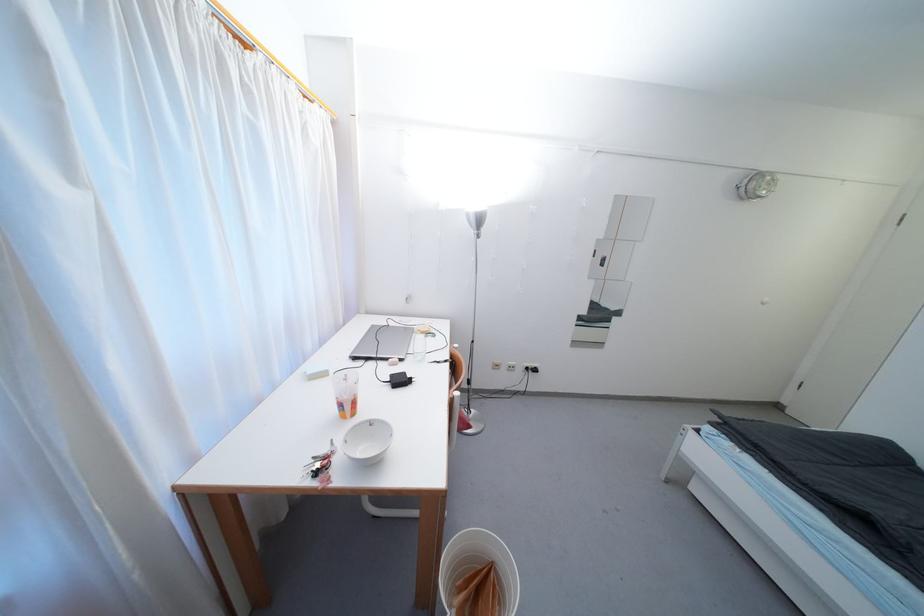
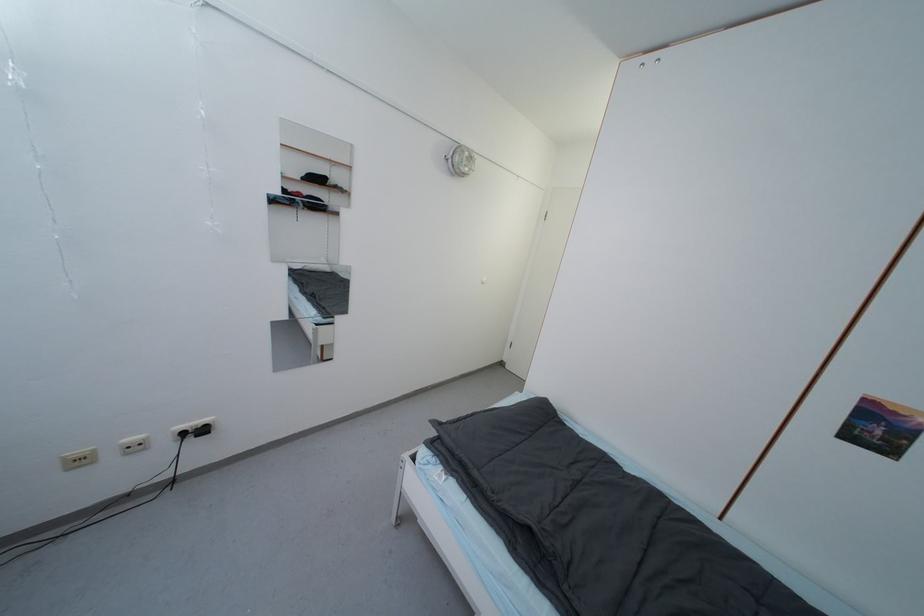
Locate, in the second image, the point that corresponds to pixel 501 369 in the first image.

(83, 464)